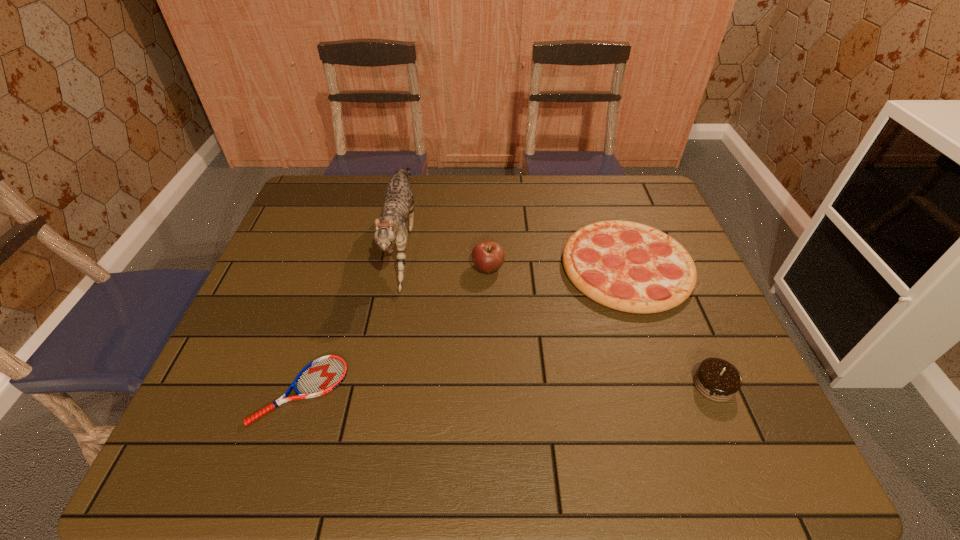
Locate an element on the screen. Image resolution: width=960 pixels, height=540 pixels. vacant space at the right edge of the desktop is located at coordinates (701, 313).

At what (x,y) coordinates should I click in order to perform the action: click on vacant point at the far right corner. Please return your answer as a coordinate pair (x, y). This screenshot has width=960, height=540. Looking at the image, I should click on (628, 178).

This screenshot has height=540, width=960. I want to click on free spot between the chocolate cake and the apple, so click(601, 326).

The height and width of the screenshot is (540, 960). Identify the location of free space between the chocolate cake and the third object from left to right. (601, 326).

Identify the location of empty space that is in between the chocolate cake and the second shortest object. (670, 326).

The height and width of the screenshot is (540, 960). Identify the location of empty space that is in between the leftmost object and the second object from left to right. click(351, 315).

Locate an element on the screen. This screenshot has height=540, width=960. empty location between the chocolate cake and the fourth object from right to left is located at coordinates pyautogui.click(x=558, y=312).

Locate an element on the screen. Image resolution: width=960 pixels, height=540 pixels. empty space that is in between the leftmost object and the third object from right to left is located at coordinates (395, 329).

Find the location of a particular element. The image size is (960, 540). free space between the chocolate cake and the fourth tallest object is located at coordinates pos(670,326).

The width and height of the screenshot is (960, 540). Identify the location of free space between the second shortest object and the tennis racket. (464, 329).